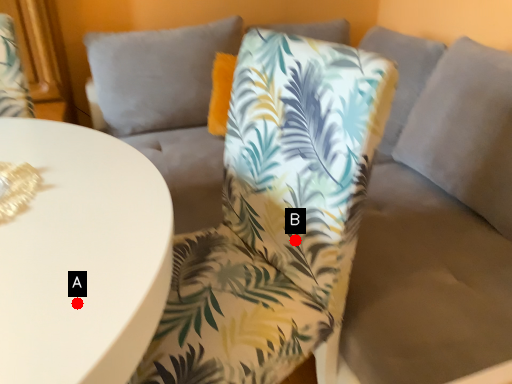
Question: Two points are circled on the image, labeled by A and B beside each circle. Which point is closer to the camera?

Choices:
 (A) A is closer
 (B) B is closer

Answer: (A)